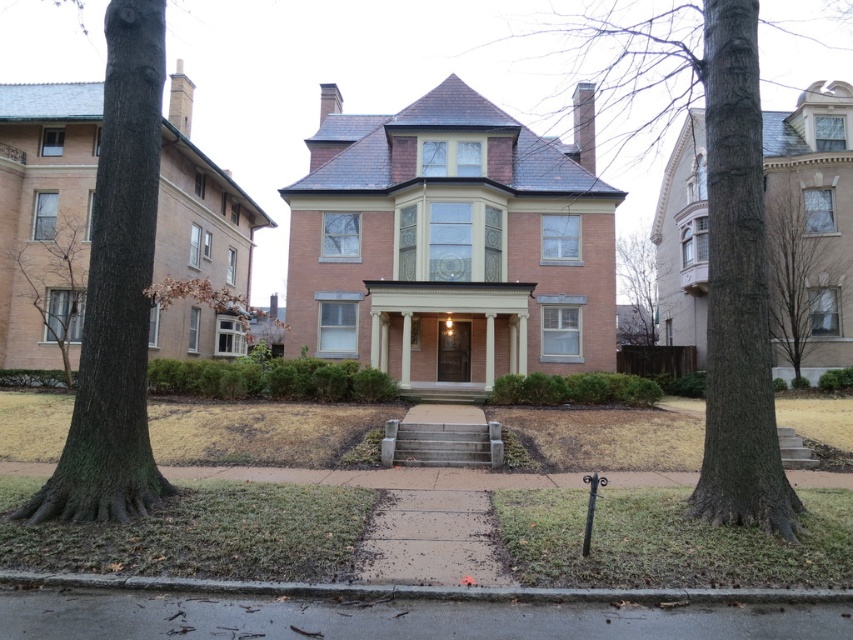
Is brown textured tree at center taller than brown bark tree at left?

Yes, brown textured tree at center is taller than brown bark tree at left.

Does point (785, 536) come in front of point (25, 285)?

Yes, point (785, 536) is in front of point (25, 285).

Which is behind, point (671, 92) or point (42, 323)?

The point (671, 92) is behind.

Where is `brown textured tree at center`? This screenshot has width=853, height=640. brown textured tree at center is located at coordinates (718, 240).

Is brown bark tree at left below green leafy tree at right?

Yes, brown bark tree at left is below green leafy tree at right.

Does brown bark tree at left lie in front of green leafy tree at right?

Yes, brown bark tree at left is closer to the viewer.

In order to click on brown bark tree at left in this screenshot , I will do `click(55, 284)`.

Is green rough bark tree at left positioned before green leafy tree at right?

Yes, green rough bark tree at left is closer to the viewer.

Is the position of green rough bark tree at left more distant than that of green leafy tree at right?

That is False.

Does point (93, 234) lie in front of point (625, 342)?

That is True.

This screenshot has height=640, width=853. I want to click on green rough bark tree at left, so click(x=115, y=291).